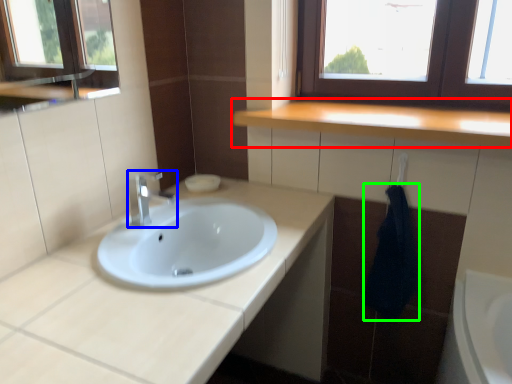
Question: Which is farther away from countertop (highlighted by a red box)? tap (highlighted by a blue box) or bath towel (highlighted by a green box)?

Choices:
 (A) tap
 (B) bath towel

Answer: (A)